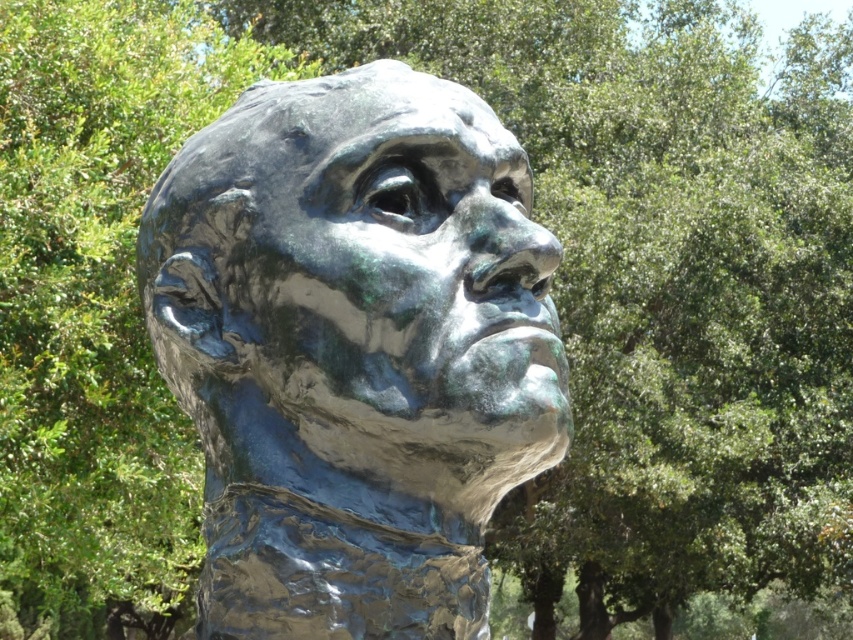
You are an art conservator examining the metallic sculpture. You notice a specific point at coordinates point (354, 349). Based on the sculpture description, what object does this point likely belong to?

The point (354, 349) corresponds to the green patina bronze head at center.

You are an art conservator examining the green patina bronze head at center and the green patina sculpture at center. Which object is bigger?

The green patina bronze head at center is larger in size compared to the green patina sculpture at center.